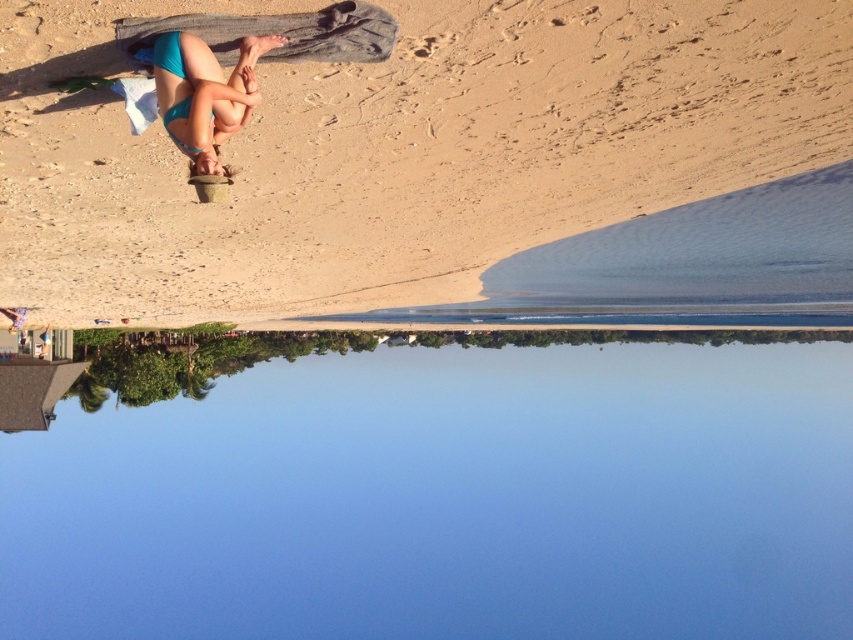
Which is below, beige sand at upper center or teal matte bikini bottom at upper left?

Positioned lower is beige sand at upper center.

Does beige sand at upper center appear on the right side of teal matte bikini bottom at upper left?

In fact, beige sand at upper center is to the left of teal matte bikini bottom at upper left.

This screenshot has height=640, width=853. Identify the location of beige sand at upper center. coord(399,148).

Which of these two, blue water at center or beige sand at upper center, stands shorter?

Standing shorter between the two is beige sand at upper center.

Can you confirm if blue water at center is positioned to the left of beige sand at upper center?

In fact, blue water at center is to the right of beige sand at upper center.

Does point (831, 628) come behind point (709, 160)?

Yes, it is.

This screenshot has height=640, width=853. I want to click on blue water at center, so click(428, 486).

Is blue water at center further to camera compared to teal matte bikini bottom at upper left?

Yes, blue water at center is behind teal matte bikini bottom at upper left.

Is point (71, 436) positioned behind point (212, 113)?

Yes, it is.

Is point (851, 401) more distant than point (228, 136)?

Yes, it is.

At what (x,y) coordinates should I click in order to perform the action: click on blue water at center. Please return your answer as a coordinate pair (x, y). Image resolution: width=853 pixels, height=640 pixels. Looking at the image, I should click on (428, 486).